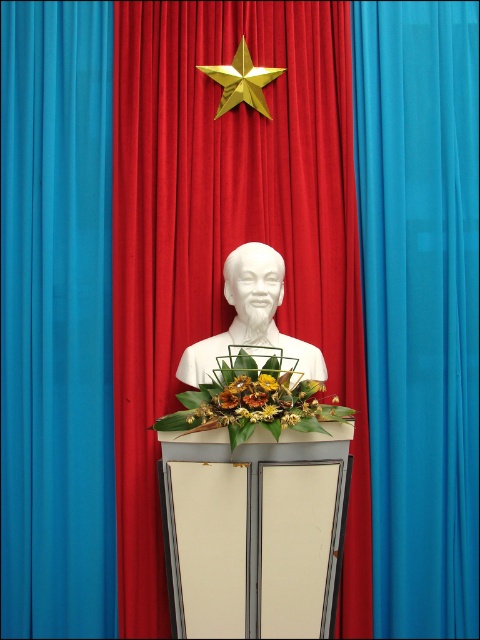
Based on the scene description, can you determine if the blue sheer curtain at center is wider than the gold metallic star at upper center?

The blue sheer curtain at center might be wider than gold metallic star at upper center according to the description.

You are standing in front of the bust on the podium. There is a point marked at coordinates (x=420, y=307). What object is located at this point?

The point at coordinates 0.485, 0.875 corresponds to the blue sheer curtain at center.

You are an art curator planning to photograph the white marble bust at center and the blue sheer curtain at center. You need to determine which object will occupy more space in your camera frame. Based on the scene description, which object should you expect to take up more area in the photo?

The blue sheer curtain at center is larger in size than the white marble bust at center, so it will occupy more space in the camera frame.